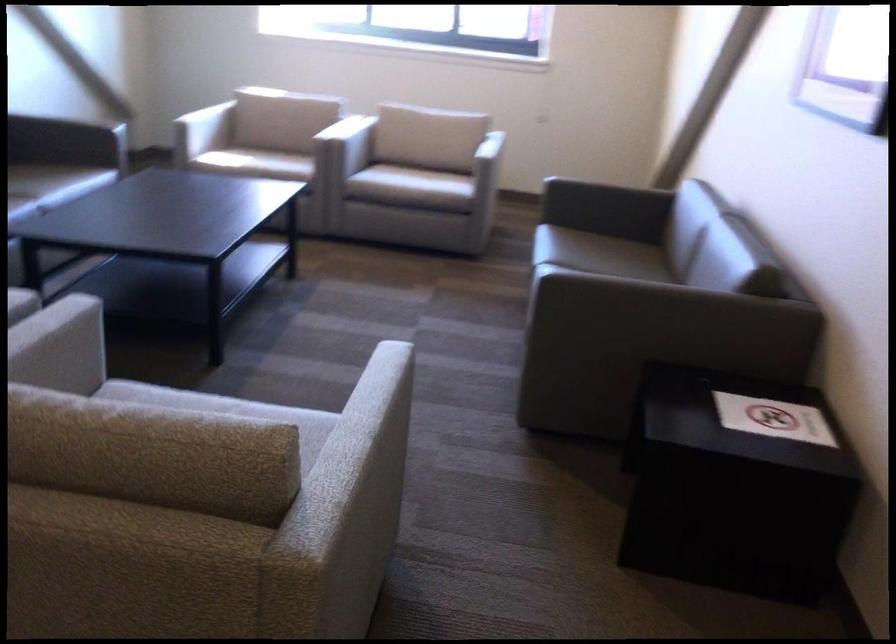
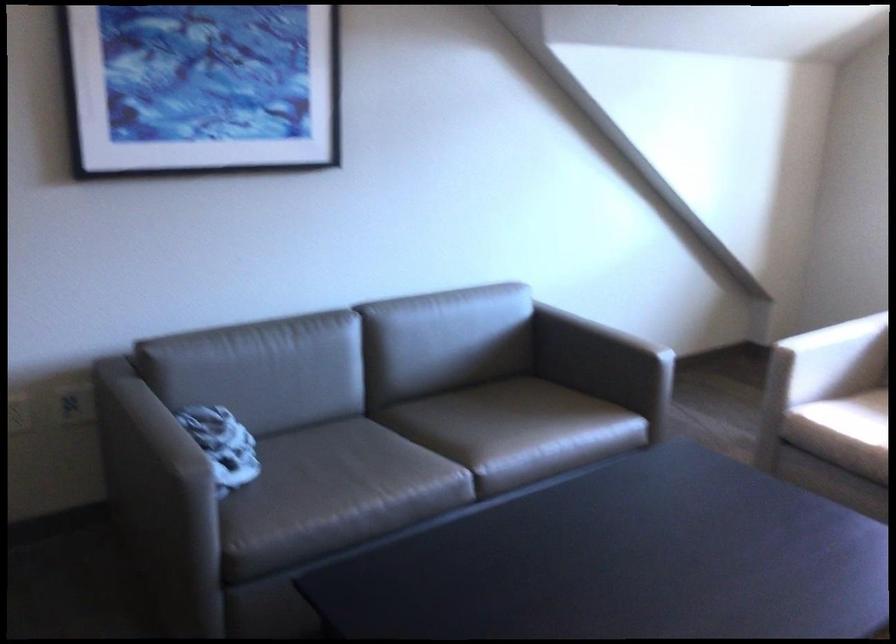
Locate, in the second image, the point that corresponds to pixel 200 117 in the first image.

(831, 359)